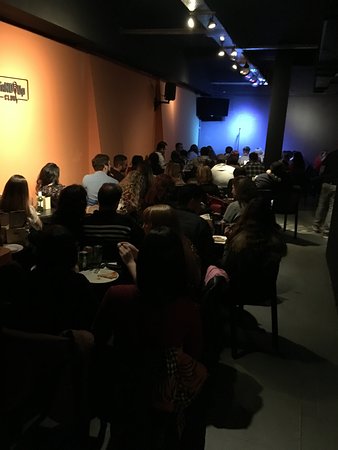
Find the location of a particular element. The width and height of the screenshot is (338, 450). plates is located at coordinates (95, 275), (220, 239).